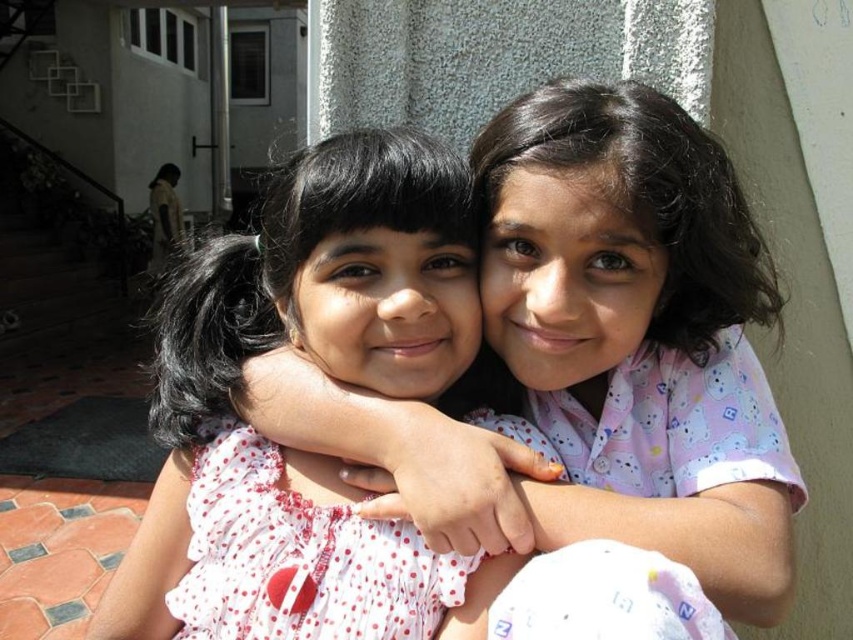
Can you confirm if white dotted dress at center is positioned to the left of white polka dot fabric dress at center?

Indeed, white dotted dress at center is positioned on the left side of white polka dot fabric dress at center.

Between white dotted dress at center and white polka dot fabric dress at center, which one appears on the left side from the viewer's perspective?

white dotted dress at center

Find the location of a particular element. white dotted dress at center is located at coordinates (334, 378).

I want to click on white dotted dress at center, so point(334,378).